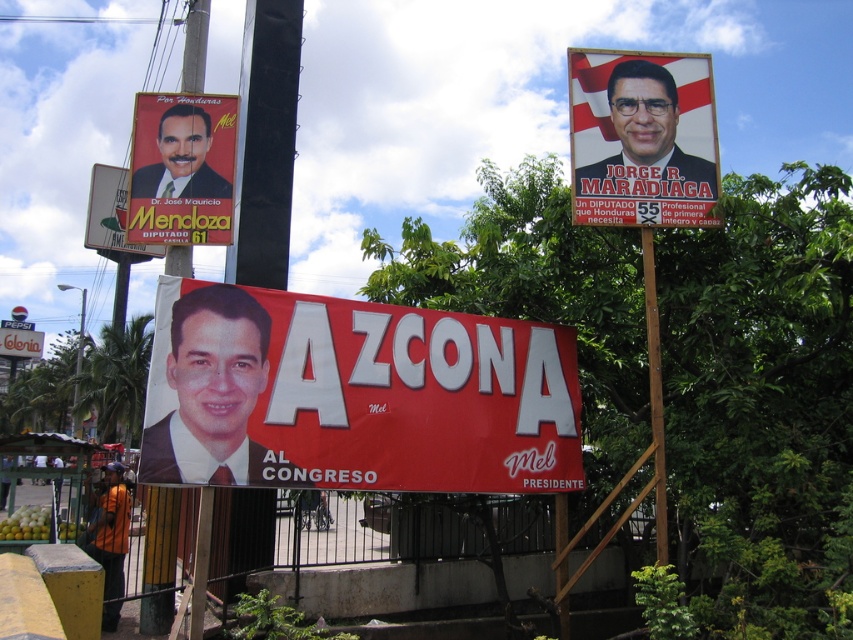
In the scene shown: You are a photographer setting up a shot of the political campaign scene. You need to ensure that both the brown wooden pole at right and the matte black banner at lower left are in focus. Given their widths, which object should you adjust your camera settings to prioritize for depth of field?

The matte black banner at lower left is wider than the brown wooden pole at right, so you should prioritize adjusting the camera settings for the matte black banner at lower left to ensure proper depth of field coverage.

You are a campaign volunteer standing at the center of the scene. You need to place a new poster exactly where the matte red banner at center is currently located. What are the coordinates where you should place the new poster?

The coordinates for the matte red banner at center are at point (354, 396), so you should place the new poster at those coordinates.

You are a campaign volunteer who needs to place a new poster that is 1.2 meters wide. The new poster must be placed between the matte plastic poster at upper right and the matte black signboard at upper left. Can the new poster fit in the space between them?

The matte plastic poster at upper right is narrower than the matte black signboard at upper left. However, the exact distance between them isn